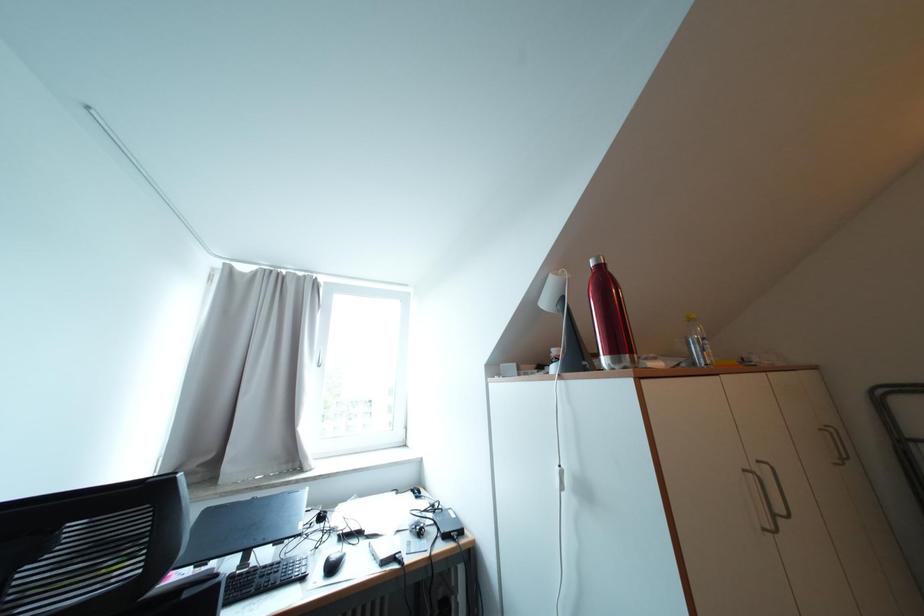
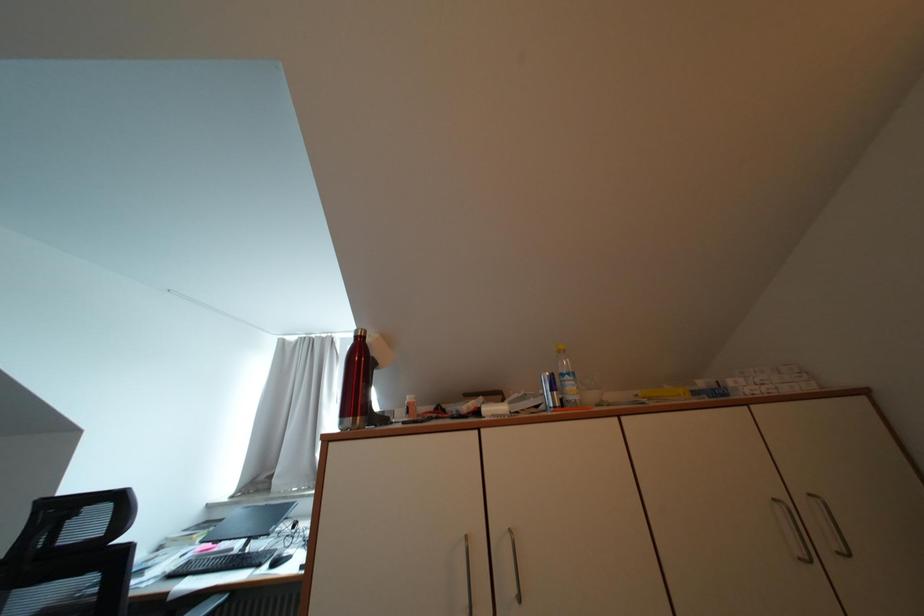
Question: Which direction would the cameraman need to move to produce the second image? Reply with the corresponding letter.

Choices:
 (A) Left
 (B) Right
 (C) Forward
 (D) Backward

Answer: (B)